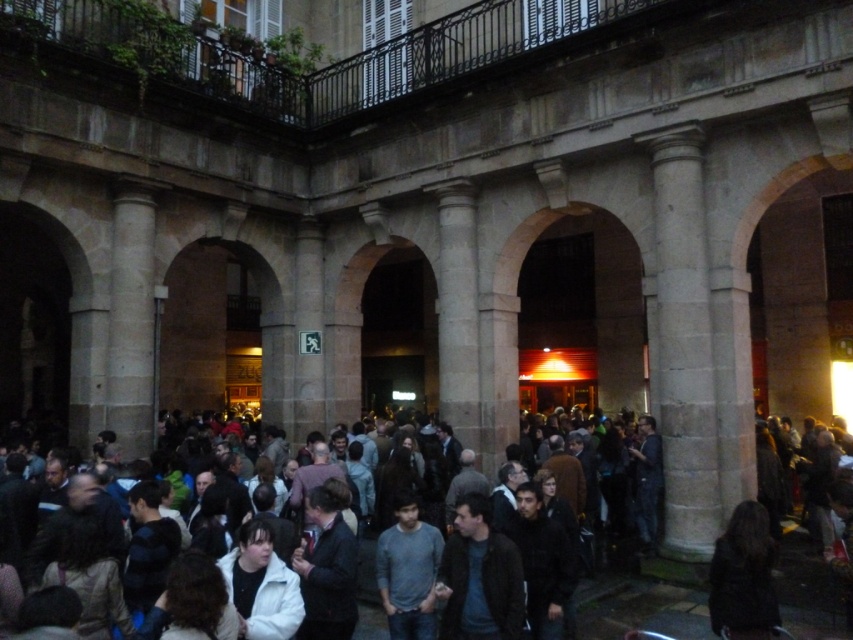
You are a photographer standing in the courtyard and want to take a photo of the gray cotton shirt at center without the dark clothing crowd at center blocking it. Is the crowd too tall to block the view?

The dark clothing crowd at center is much taller than the gray cotton shirt at center, so the crowd will block the view of the gray cotton shirt at center.

You are trying to navigate through the dark clothing crowd at center and the gray cotton shirt at center in the crowded plaza. Which group or individual do you need to maneuver around more carefully due to their size?

The dark clothing crowd at center has a larger width than the gray cotton shirt at center, so you need to maneuver around the dark clothing crowd at center more carefully due to their size.

You are standing in the courtyard and want to take a photo of the gray cotton shirt at center without the dark clothing crowd at center blocking the view. Is this possible given their positions?

The dark clothing crowd at center is closer to the viewer than the gray cotton shirt at center, so the crowd would block the view of the gray cotton shirt at center unless you move to a position where they are out of the way.